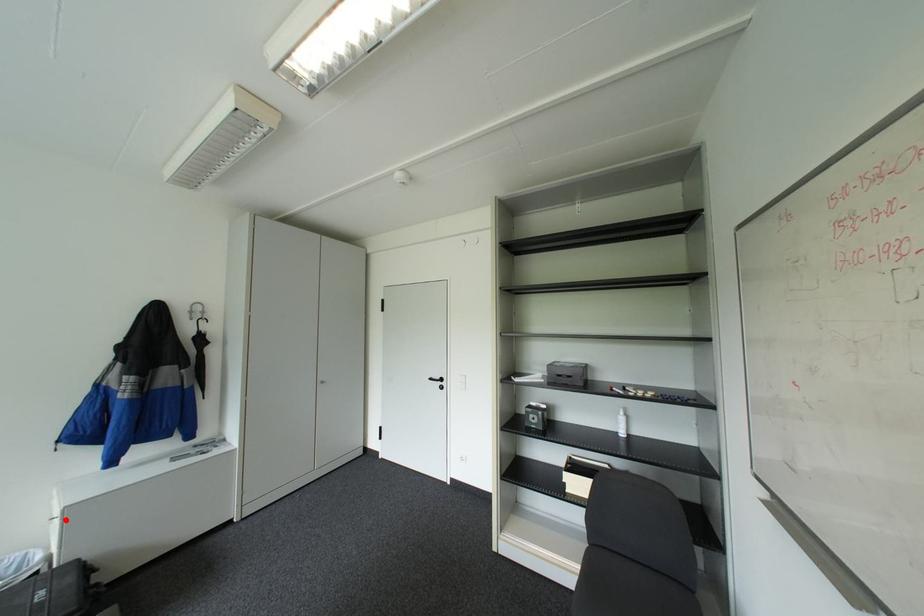
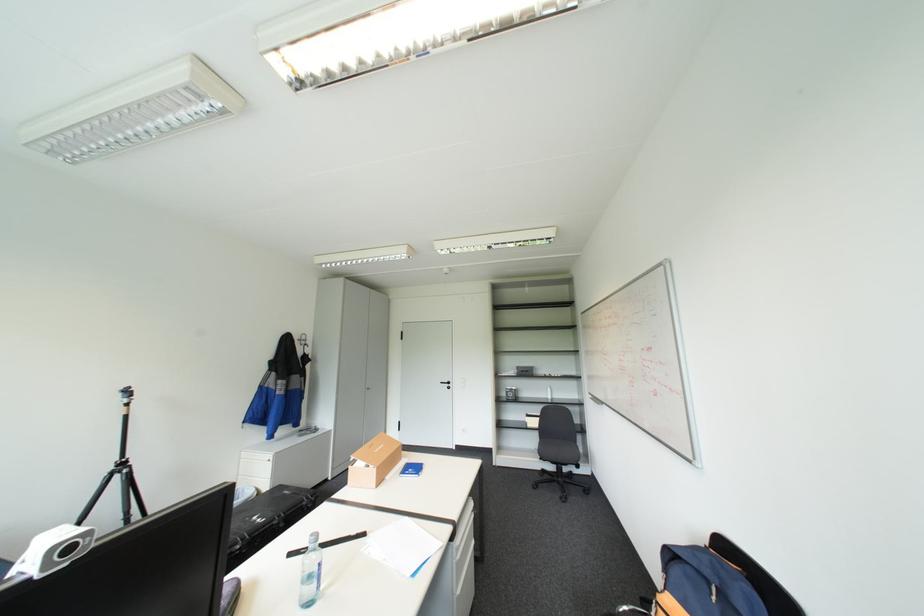
Locate, in the second image, the point that corresponds to the highlighted location in the first image.

(278, 461)